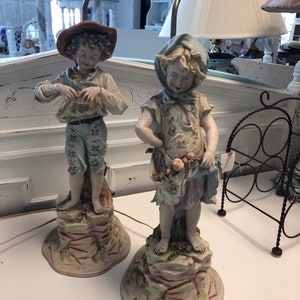
This screenshot has width=300, height=300. What are the coordinates of `black rack` in the screenshot? It's located at (274, 170).